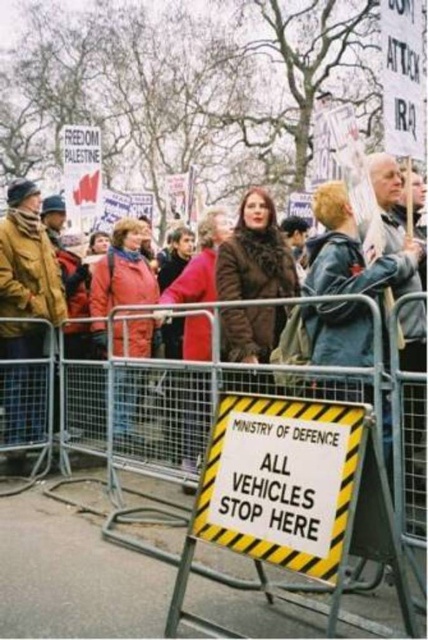
Question: Which point is farther to the camera?

Choices:
 (A) (243, 200)
 (B) (296, 420)

Answer: (A)

Question: Can you confirm if brown leather jacket at left is positioned to the right of metallic silver fence at center?

Choices:
 (A) yes
 (B) no

Answer: (B)

Question: Can you confirm if yellow/black striped sign at center is positioned to the right of brown leather jacket at left?

Choices:
 (A) yes
 (B) no

Answer: (A)

Question: Which point is farther to the camera?

Choices:
 (A) brown fuzzy coat at center
 (B) metallic silver fence at center
 (C) brown leather jacket at left

Answer: (C)

Question: Is yellow/black striped sign at center above metallic silver fence at center?

Choices:
 (A) no
 (B) yes

Answer: (A)

Question: Among these points, which one is farthest from the camera?

Choices:
 (A) (124, 237)
 (B) (9, 260)
 (C) (392, 365)
 (D) (237, 218)

Answer: (D)